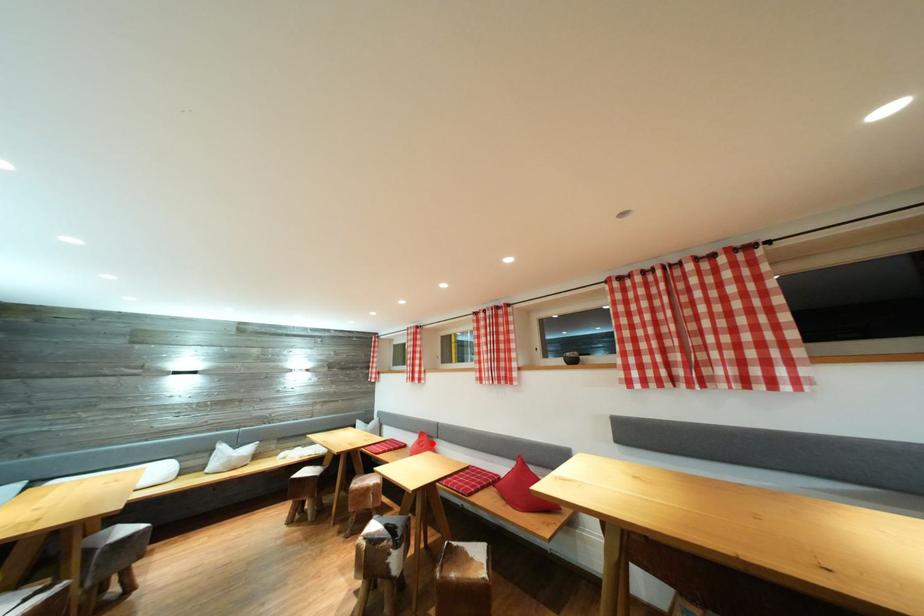
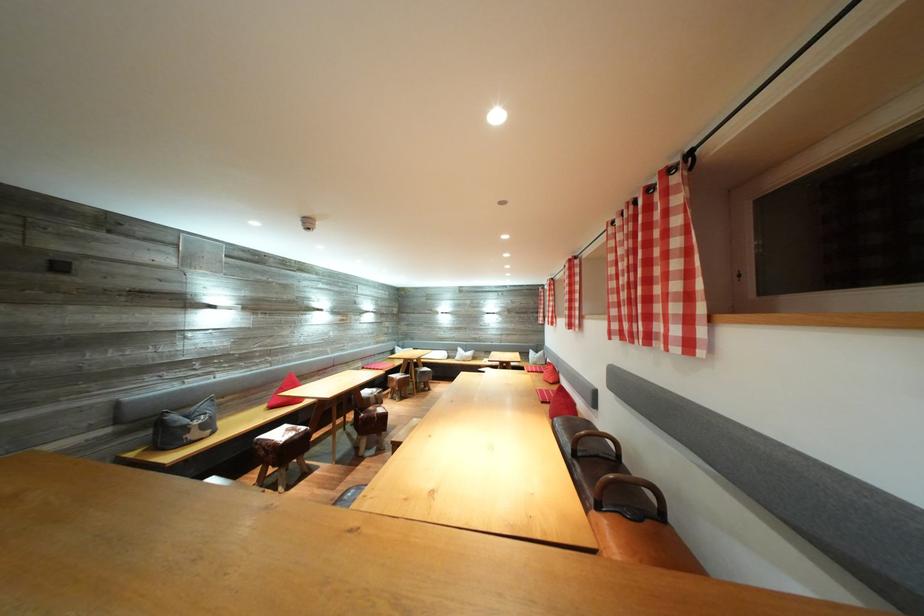
The point at the highlighted location is marked in the first image. Where is the corresponding point in the second image?

(557, 373)